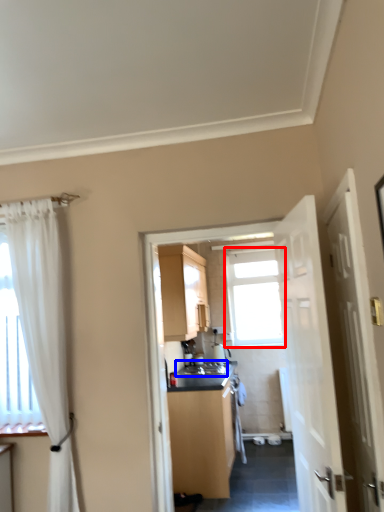
Question: Which object appears closest to the camera in this image, window (highlighted by a red box) or sink (highlighted by a blue box)?

Choices:
 (A) window
 (B) sink

Answer: (B)